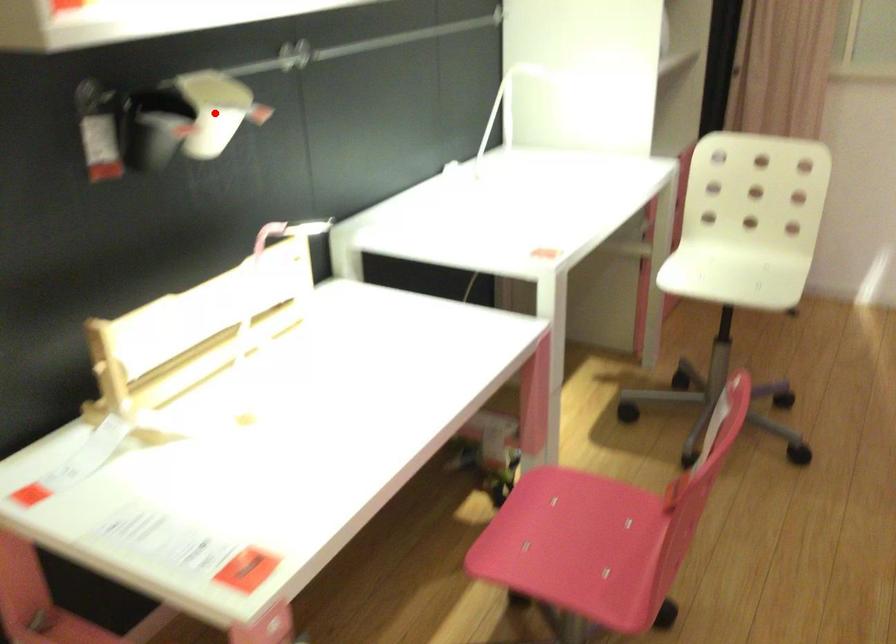
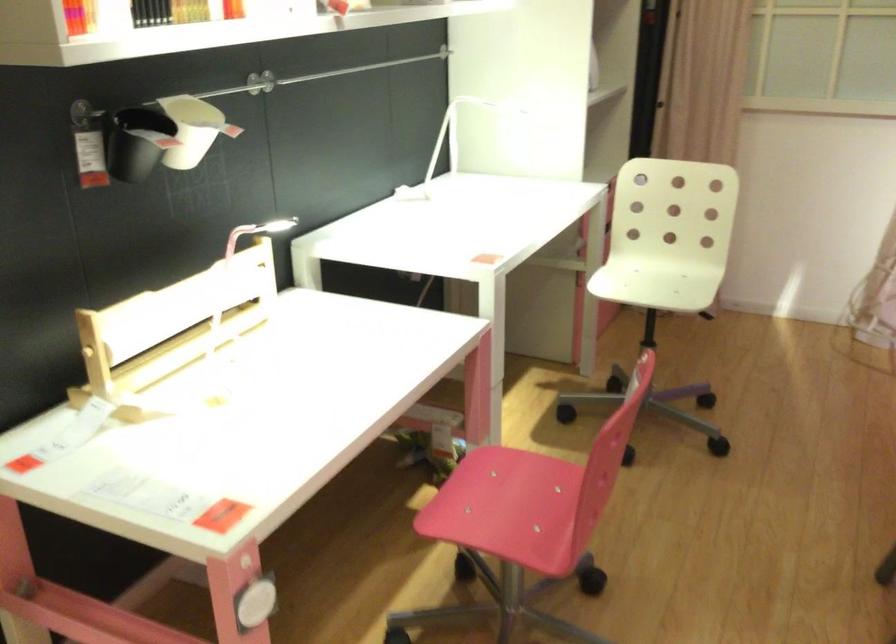
Question: A red point is marked in image1. In image2, is the corresponding 3D point closer to the camera or farther? Reply with the corresponding letter.

Choices:
 (A) The corresponding 3D point is closer.
 (B) The corresponding 3D point is farther.

Answer: (B)